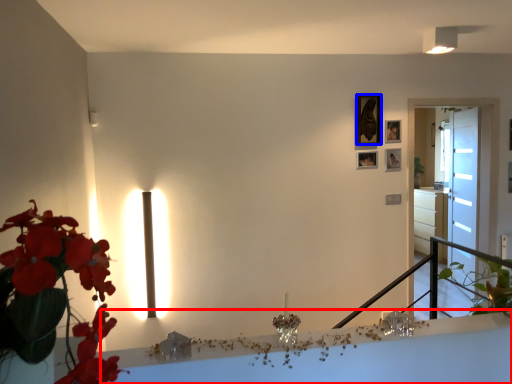
Question: Which object appears farthest to the camera in this image, table (highlighted by a red box) or picture frame (highlighted by a blue box)?

Choices:
 (A) table
 (B) picture frame

Answer: (B)